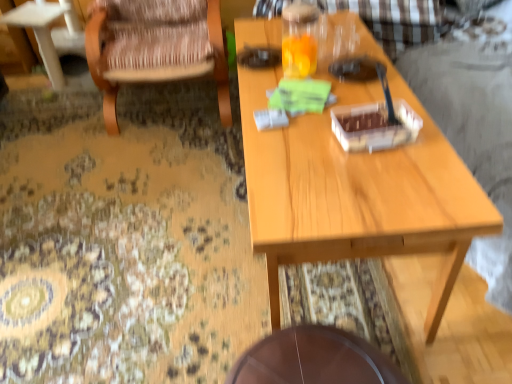
Question: Considering the relative sizes of wooden coffee table at left and wooden woven chair at left in the image provided, is wooden coffee table at left smaller than wooden woven chair at left?

Choices:
 (A) no
 (B) yes

Answer: (B)

Question: Is wooden coffee table at left facing away from wooden woven chair at left?

Choices:
 (A) yes
 (B) no

Answer: (B)

Question: Is wooden coffee table at left positioned in front of wooden woven chair at left?

Choices:
 (A) yes
 (B) no

Answer: (B)

Question: Does wooden coffee table at left have a larger size compared to wooden woven chair at left?

Choices:
 (A) no
 (B) yes

Answer: (A)

Question: From a real-world perspective, is wooden coffee table at left positioned over wooden woven chair at left based on gravity?

Choices:
 (A) no
 (B) yes

Answer: (A)

Question: Is wooden coffee table at left thinner than wooden woven chair at left?

Choices:
 (A) no
 (B) yes

Answer: (B)

Question: Is light wood table at center wider than brown wooden table at lower center?

Choices:
 (A) yes
 (B) no

Answer: (A)

Question: Is light wood table at center turned away from brown wooden table at lower center?

Choices:
 (A) yes
 (B) no

Answer: (B)

Question: Considering the relative sizes of light wood table at center and brown wooden table at lower center in the image provided, is light wood table at center bigger than brown wooden table at lower center?

Choices:
 (A) yes
 (B) no

Answer: (A)

Question: Would you say brown wooden table at lower center is part of light wood table at center's contents?

Choices:
 (A) yes
 (B) no

Answer: (B)

Question: From a real-world perspective, is light wood table at center beneath brown wooden table at lower center?

Choices:
 (A) yes
 (B) no

Answer: (B)

Question: From the image's perspective, is light wood table at center on brown wooden table at lower center?

Choices:
 (A) yes
 (B) no

Answer: (A)

Question: Can we say light wood table at center lies outside wooden coffee table at left?

Choices:
 (A) yes
 (B) no

Answer: (A)